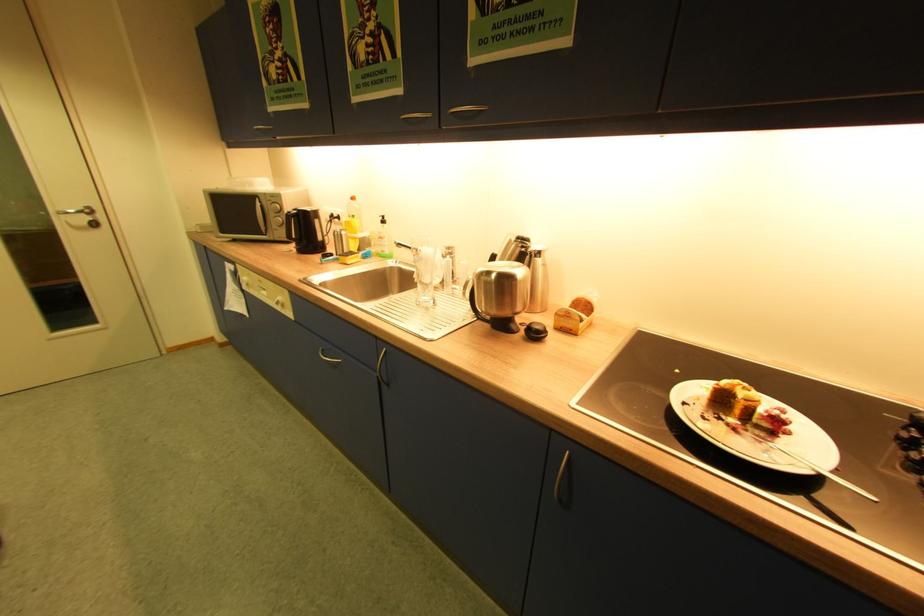
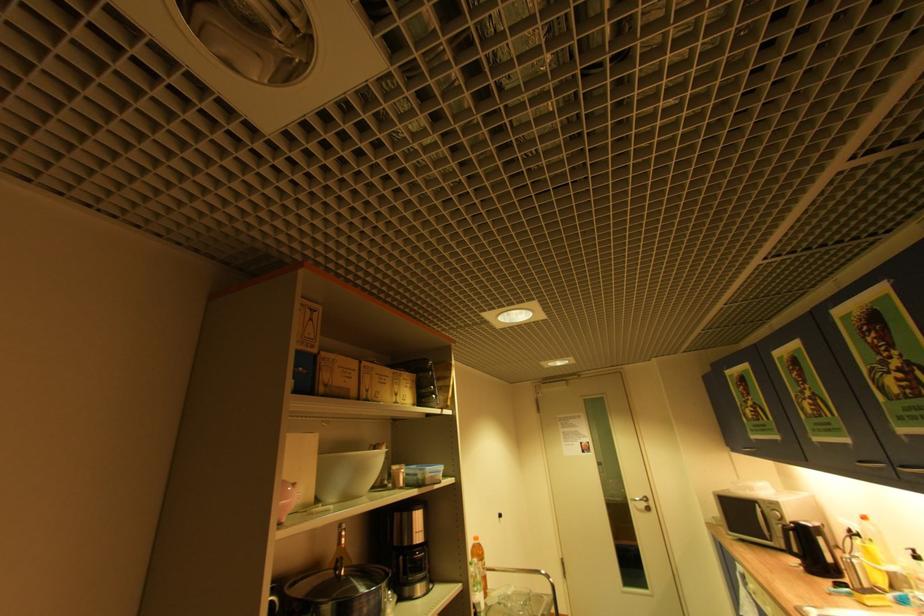
The point at [337,217] is marked in the first image. Where is the corresponding point in the second image?

(856, 532)